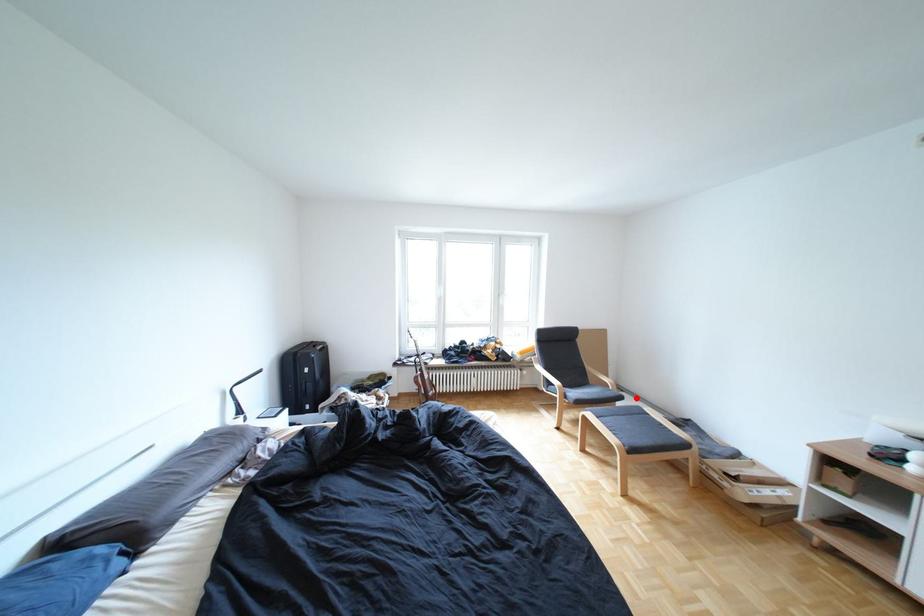
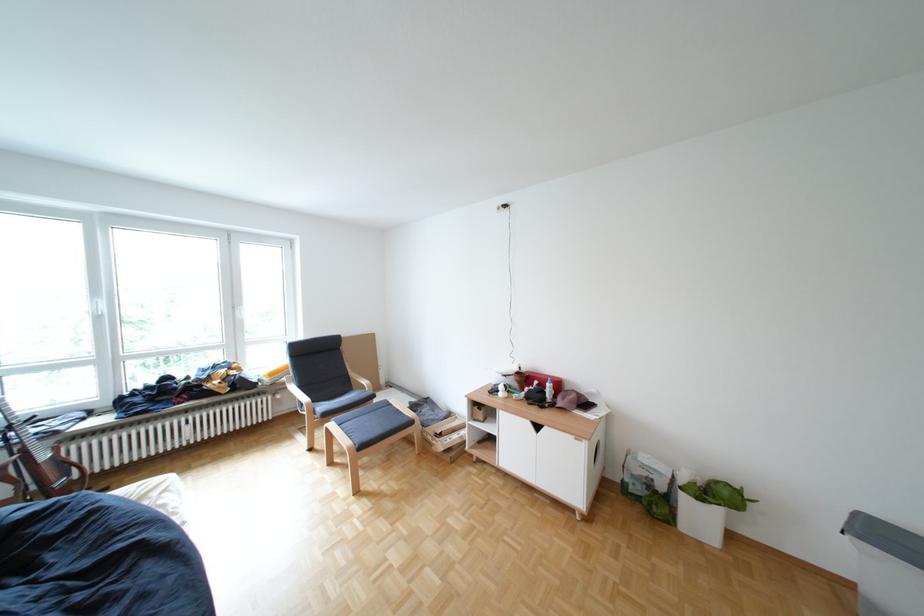
Locate, in the second image, the point that corresponds to the highlighted location in the first image.

(388, 397)